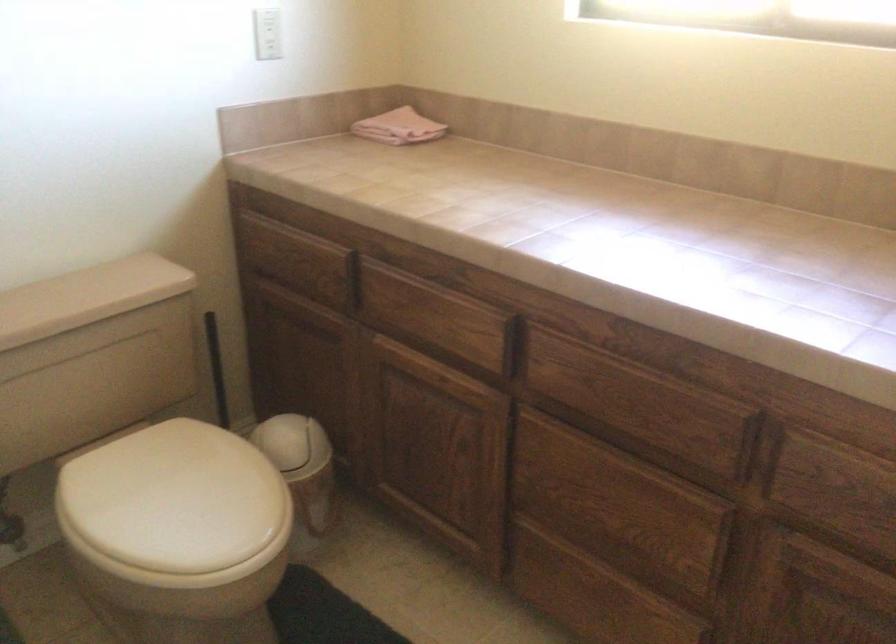
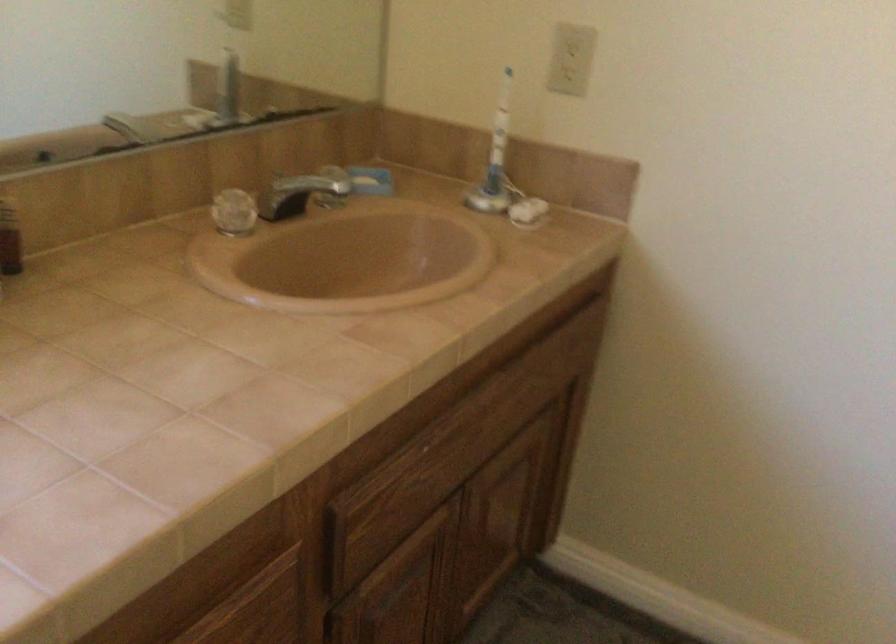
Based on the continuous images, in which direction is the camera rotating?

The camera rotated toward right-down.